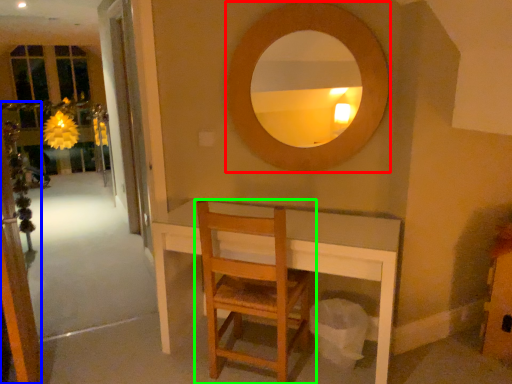
Question: Which is nearer to the mirror (highlighted by a red box)? screen door (highlighted by a blue box) or chair (highlighted by a green box).

Choices:
 (A) screen door
 (B) chair

Answer: (B)